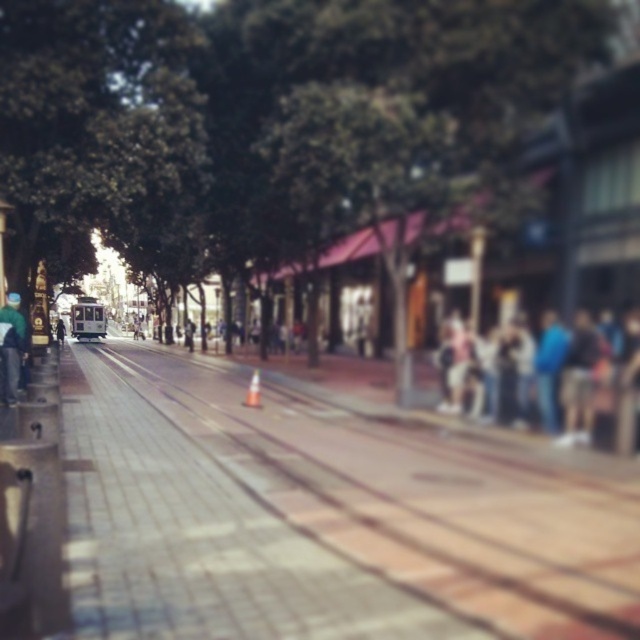
You are a pedestrian standing on the sidewalk and see the blue denim jeans at center right and the dark blue jacket at center. Which item is nearer to you?

The blue denim jeans at center right is closer to the viewer than the dark blue jacket at center.

You are a pedestrian walking on the sidewalk and see the brick paved train track at left and the green fabric jacket at left. Which object is closer to the tram tracks?

The brick paved train track at left is to the right of the green fabric jacket at left, so the green fabric jacket at left is closer to the tram tracks.

You are a pedestrian wearing a size medium jacket. You see a green fabric jacket at left and a dark blue jacket at center. Which jacket is more likely to fit you?

The dark blue jacket at center is larger than the green fabric jacket at left, so it is more likely to fit a medium size.